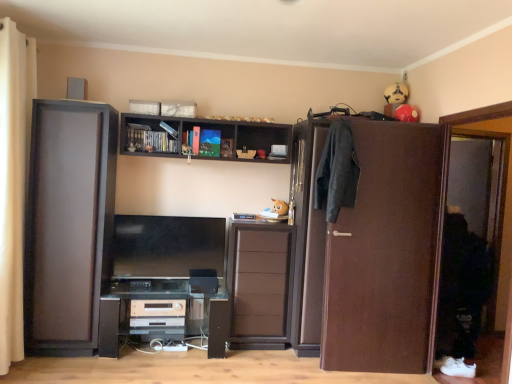
The height and width of the screenshot is (384, 512). In order to click on blank space situated above silver metallic stereo at center, which ranks as the first appliance in left-to-right order (from a real-world perspective) in this screenshot , I will do `click(159, 294)`.